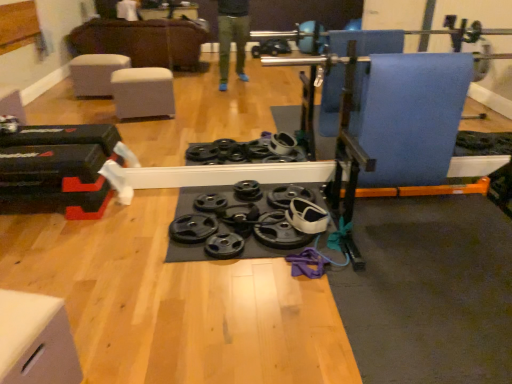
Question: Considering the relative sizes of black rubber weight plate at center, placed as the second wheel when sorted from right to left, and white matte drawer at lower left in the image provided, is black rubber weight plate at center, placed as the second wheel when sorted from right to left, shorter than white matte drawer at lower left?

Choices:
 (A) yes
 (B) no

Answer: (A)

Question: Is black rubber weight plate at center, placed as the 2th wheel when sorted from left to right, smaller than white matte drawer at lower left?

Choices:
 (A) no
 (B) yes

Answer: (B)

Question: Is black rubber weight plate at center, placed as the 2th wheel when sorted from left to right, oriented away from white matte drawer at lower left?

Choices:
 (A) no
 (B) yes

Answer: (A)

Question: Is black rubber weight plate at center, placed as the second wheel when sorted from right to left, further to camera compared to white matte drawer at lower left?

Choices:
 (A) yes
 (B) no

Answer: (A)

Question: Does black rubber weight plate at center, placed as the second wheel when sorted from right to left, contain white matte drawer at lower left?

Choices:
 (A) yes
 (B) no

Answer: (B)

Question: From the image's perspective, is black rubber weight plate at center, placed as the 2th wheel when sorted from left to right, located above white matte drawer at lower left?

Choices:
 (A) yes
 (B) no

Answer: (A)

Question: Are black rubber weight plate at center, the first wheel viewed from the left, and black rubber weight plate at center, placed as the second wheel when sorted from right to left, beside each other?

Choices:
 (A) no
 (B) yes

Answer: (A)

Question: Is black rubber weight plate at center, the first wheel viewed from the left, outside black rubber weight plate at center, placed as the second wheel when sorted from right to left?

Choices:
 (A) no
 (B) yes

Answer: (B)

Question: Is black rubber weight plate at center, the third wheel from the right, to the right of black rubber weight plate at center, placed as the second wheel when sorted from right to left, from the viewer's perspective?

Choices:
 (A) yes
 (B) no

Answer: (B)

Question: Is black rubber weight plate at center, the first wheel viewed from the left, taller than black rubber weight plate at center, placed as the 2th wheel when sorted from left to right?

Choices:
 (A) no
 (B) yes

Answer: (B)

Question: From the image's perspective, is black rubber weight plate at center, the first wheel viewed from the left, located above black rubber weight plate at center, placed as the 2th wheel when sorted from left to right?

Choices:
 (A) yes
 (B) no

Answer: (A)

Question: From a real-world perspective, is black rubber weight plate at center, the first wheel viewed from the left, positioned under black rubber weight plate at center, placed as the 2th wheel when sorted from left to right, based on gravity?

Choices:
 (A) no
 (B) yes

Answer: (A)

Question: Considering the relative positions of black rubber weight plate at center, the first wheel viewed from the left, and white matte drawer at lower left in the image provided, is black rubber weight plate at center, the first wheel viewed from the left, to the left of white matte drawer at lower left from the viewer's perspective?

Choices:
 (A) yes
 (B) no

Answer: (B)